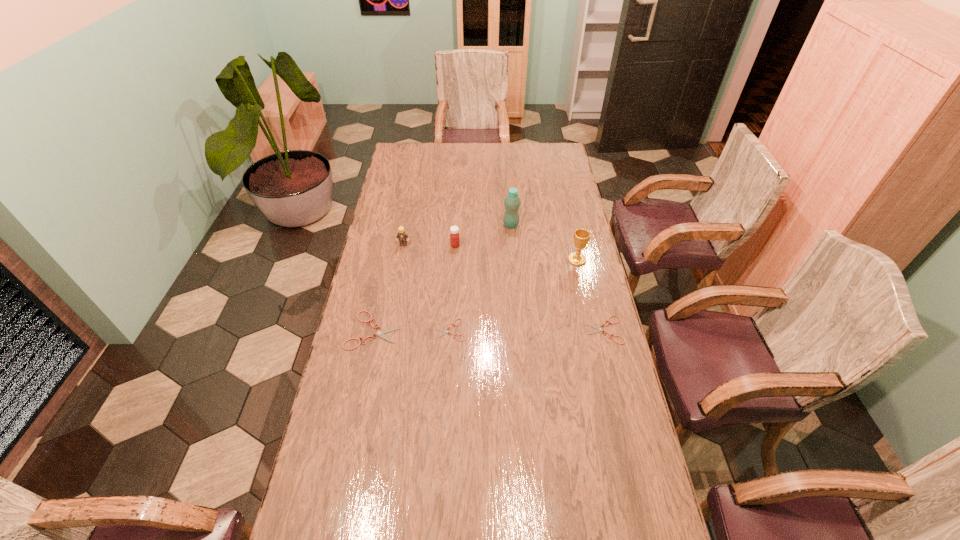
Identify the location of Lego positioned at the left edge. (402, 235).

This screenshot has height=540, width=960. In order to click on shears that is at the right edge in this screenshot , I will do `click(599, 329)`.

Identify the location of chalice that is at the right edge. (581, 236).

Where is `vacant area at the far edge of the desktop`? The width and height of the screenshot is (960, 540). vacant area at the far edge of the desktop is located at coordinates (491, 157).

Where is `vacant space at the near edge of the desktop`? vacant space at the near edge of the desktop is located at coordinates (537, 525).

Where is `vacant region at the left edge`? Image resolution: width=960 pixels, height=540 pixels. vacant region at the left edge is located at coordinates (382, 326).

At what (x,y) coordinates should I click in order to perform the action: click on vacant area at the right edge of the desktop. Please return your answer as a coordinate pair (x, y). The width and height of the screenshot is (960, 540). Looking at the image, I should click on (567, 286).

The height and width of the screenshot is (540, 960). I want to click on vacant region between the third object from right to left and the rightmost shears, so click(x=558, y=278).

Where is `vacant space in between the second tallest object and the leftmost shears`? The height and width of the screenshot is (540, 960). vacant space in between the second tallest object and the leftmost shears is located at coordinates (475, 295).

Find the location of a particular element. The width and height of the screenshot is (960, 540). free space between the tallest shears and the medicine is located at coordinates (415, 288).